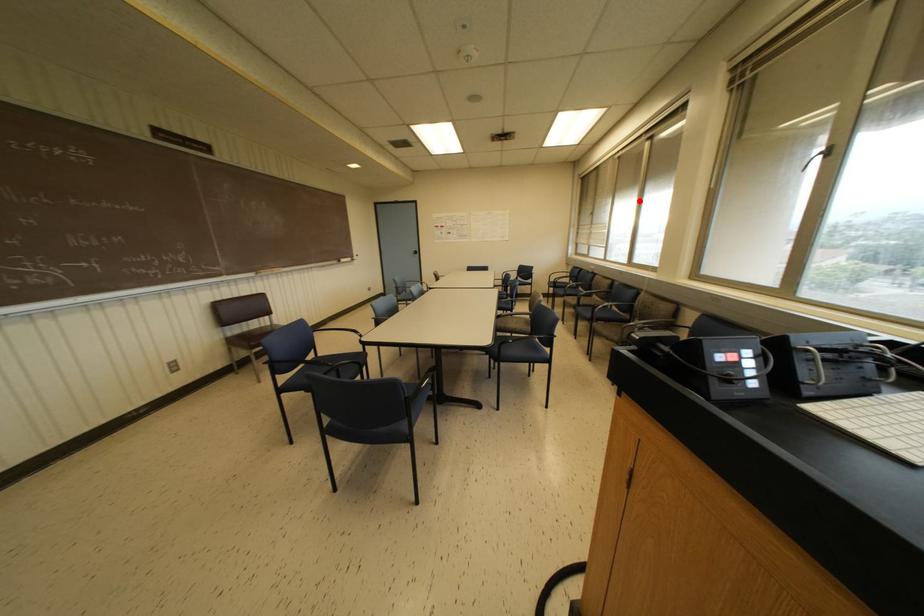
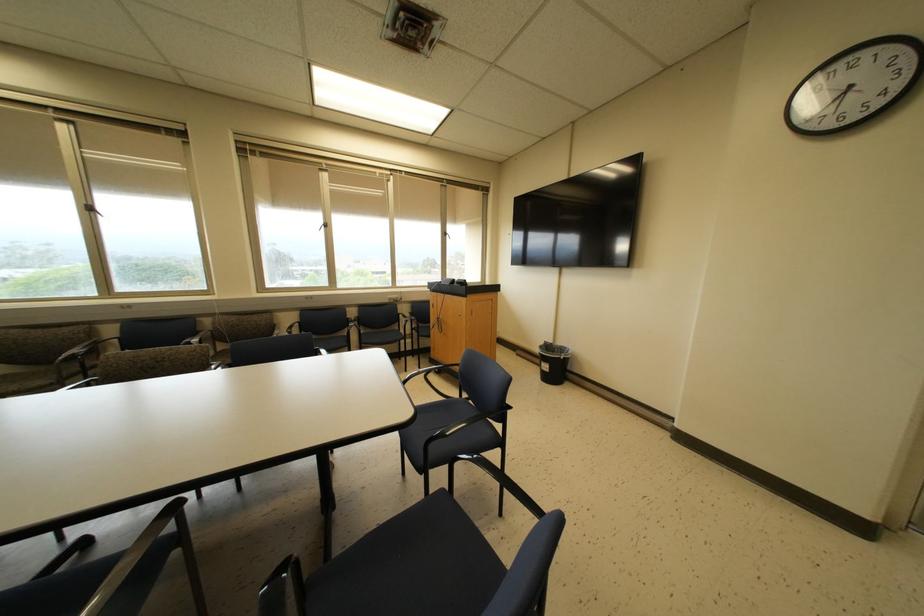
Find the pixel in the second image that matches the highlighted location in the first image.

(89, 208)